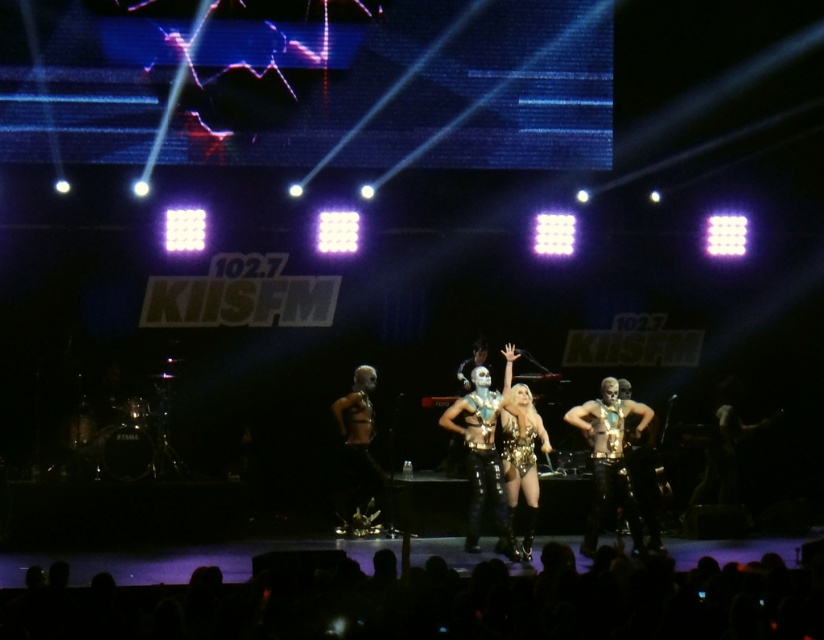
Question: Does gold metallic costume at center appear on the right side of sparkly gold bodysuit at center?

Choices:
 (A) no
 (B) yes

Answer: (A)

Question: Is gold metallic costume at center to the right of sparkly gold bodysuit at center from the viewer's perspective?

Choices:
 (A) yes
 (B) no

Answer: (B)

Question: Which of the following is the farthest from the observer?

Choices:
 (A) (354, 417)
 (B) (602, 444)
 (C) (532, 499)

Answer: (A)

Question: Is gold metallic suit at center closer to the viewer compared to gold metallic costume at center?

Choices:
 (A) no
 (B) yes

Answer: (B)

Question: Which point is farther to the camera?

Choices:
 (A) (523, 412)
 (B) (640, 538)
 (C) (371, 486)

Answer: (C)

Question: Estimate the real-world distances between objects in this image. Which object is farther from the gold metallic suit at center?

Choices:
 (A) sparkly gold bodysuit at center
 (B) gold metallic costume at center

Answer: (B)